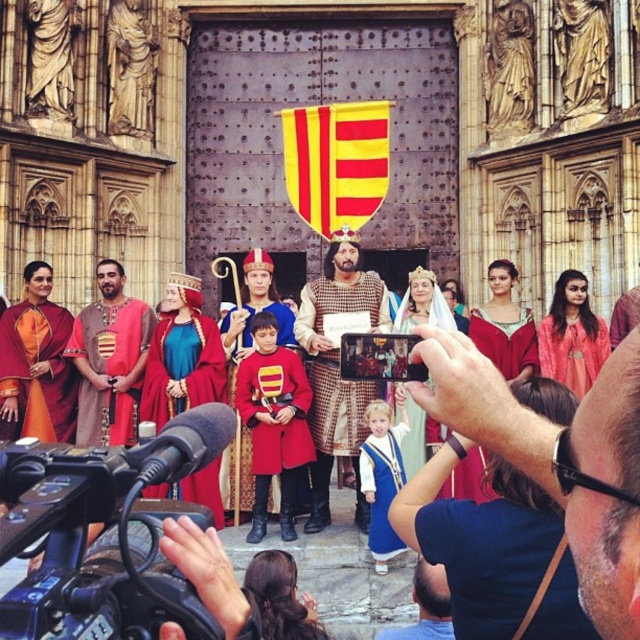
Does matte gold crown at center appear on the left side of matte red tunic at center?

Incorrect, matte gold crown at center is not on the left side of matte red tunic at center.

Where is `matte gold crown at center`? matte gold crown at center is located at coordinates [557, 460].

Who is more forward, [433,358] or [106,388]?

Point [433,358] is in front.

The height and width of the screenshot is (640, 640). In order to click on matte gold crown at center in this screenshot , I will do `click(557, 460)`.

Is point (492, 518) more distant than point (584, 356)?

No, (492, 518) is in front of (584, 356).

Is blue velvet robe at center bigger than matte pink dress at center?

Actually, blue velvet robe at center might be smaller than matte pink dress at center.

Is point (458, 506) positioned in front of point (541, 348)?

Yes, it is.

Image resolution: width=640 pixels, height=640 pixels. What are the coordinates of `blue velvet robe at center` in the screenshot? It's located at (486, 560).

Who is positioned more to the right, checkered fabric tunic at center or matte pink dress at center?

Positioned to the right is matte pink dress at center.

Based on the photo, between checkered fabric tunic at center and matte pink dress at center, which one has more height?

With more height is checkered fabric tunic at center.

Does point (337, 420) lie behind point (580, 362)?

That is False.

Where is `checkered fabric tunic at center`? The width and height of the screenshot is (640, 640). checkered fabric tunic at center is located at coordinates (337, 369).